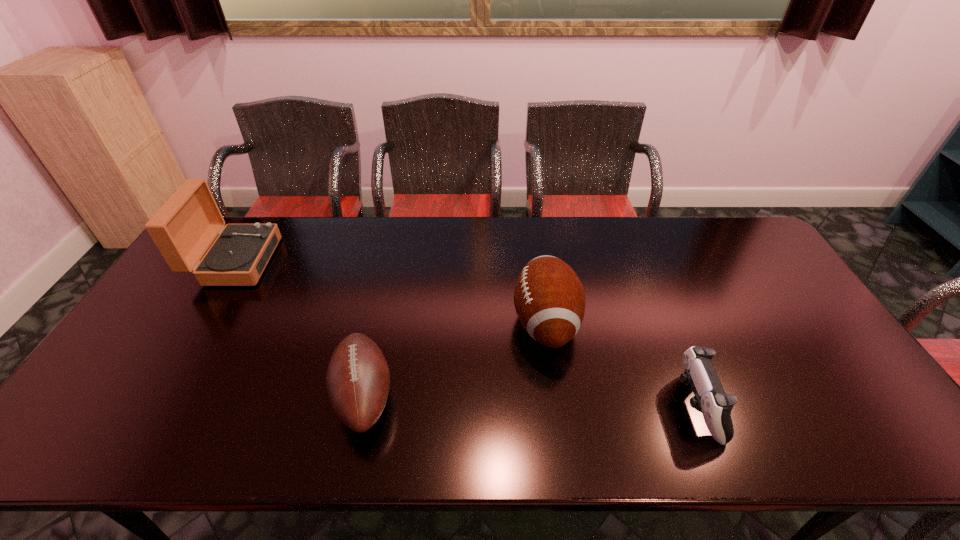
At what (x,y) coordinates should I click in order to perform the action: click on the leftmost object. Please return your answer as a coordinate pair (x, y). This screenshot has height=540, width=960. Looking at the image, I should click on (185, 226).

Where is `the tallest object`? This screenshot has height=540, width=960. the tallest object is located at coordinates (185, 226).

You are a GUI agent. You are given a task and a screenshot of the screen. Output one action in this format:
    pyautogui.click(x=<x>, y=<y>)
    Task: Click on the third object from left to right
    The width and height of the screenshot is (960, 540).
    Given the screenshot: What is the action you would take?
    pyautogui.click(x=549, y=298)

This screenshot has height=540, width=960. Identify the location of the taller football (American). (549, 298).

The height and width of the screenshot is (540, 960). What are the coordinates of `the shorter football (American)` in the screenshot? It's located at (358, 379).

In order to click on the second object from left to right in this screenshot , I will do `click(358, 379)`.

Where is `the rightmost object`? This screenshot has width=960, height=540. the rightmost object is located at coordinates (710, 399).

At what (x,y) coordinates should I click in order to perform the action: click on vacant region located 0.060m on the face of the tallest object. Please return your answer as a coordinate pair (x, y). This screenshot has height=540, width=960. Looking at the image, I should click on (289, 261).

The width and height of the screenshot is (960, 540). Find the location of `vacant space located 0.130m on the laces of the taller football (American)`. vacant space located 0.130m on the laces of the taller football (American) is located at coordinates (467, 322).

At what (x,y) coordinates should I click in order to perform the action: click on vacant space situated 0.120m on the laces of the taller football (American). Please return your answer as a coordinate pair (x, y). Looking at the image, I should click on (469, 322).